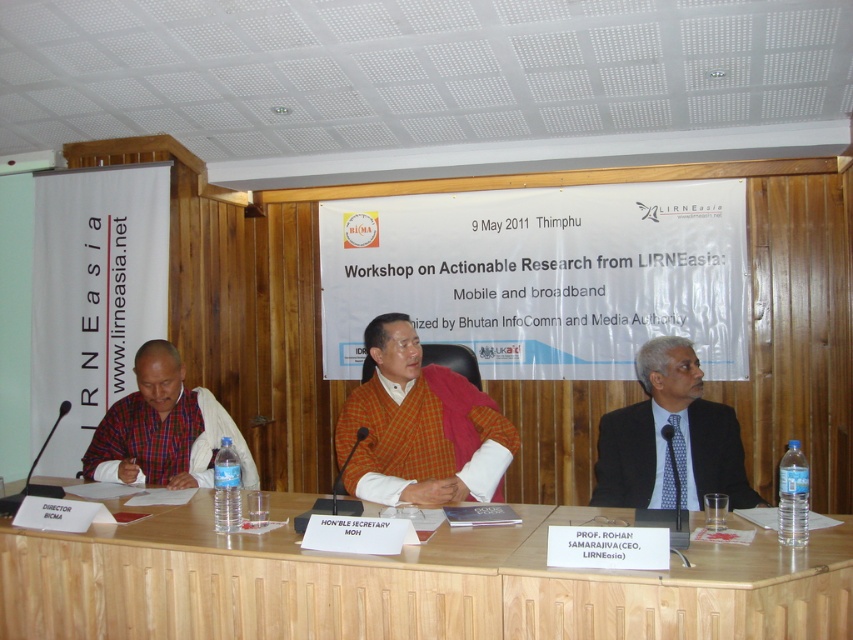
You are attending the Thimphu Workshop and need to hand a document to the person wearing the matte plaid shirt at left. Where should you place the document so that it is closest to them but still on the light brown wood table at center?

The document should be placed on the light brown wood table at center near the area directly below the matte plaid shirt at left, as the table is positioned below the shirt.

You are standing at the front of the room looking towards the banner. Which of the two points, point (x=595, y=212) or point (x=740, y=445), is closer to you?

Point (x=595, y=212) is closer to you because it is further to the viewer than point (x=740, y=445).

In the scene shown: You are a guest at the event and want to place a 2.5 feet wide laptop on the light brown wood table at center. Can you fit it without overlapping the nameplates?

The light brown wood table at center has a length of 5.90 feet. Since the laptop is 2.5 feet wide, it can easily fit on the table without overlapping the nameplates as there is sufficient space.